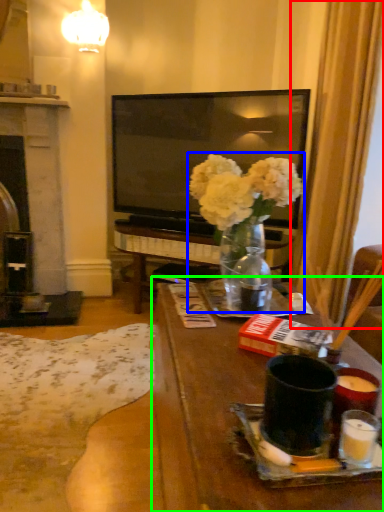
Question: Considering the real-world distances, which object is closest to curtain (highlighted by a red box)? floral arrangement (highlighted by a blue box) or table (highlighted by a green box).

Choices:
 (A) floral arrangement
 (B) table

Answer: (A)